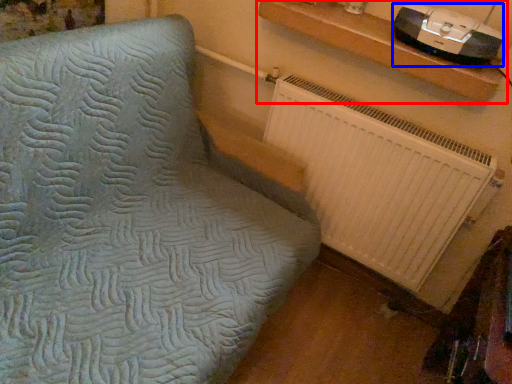
Question: Among these objects, which one is farthest to the camera, shelf (highlighted by a red box) or stereo (highlighted by a blue box)?

Choices:
 (A) shelf
 (B) stereo

Answer: (A)